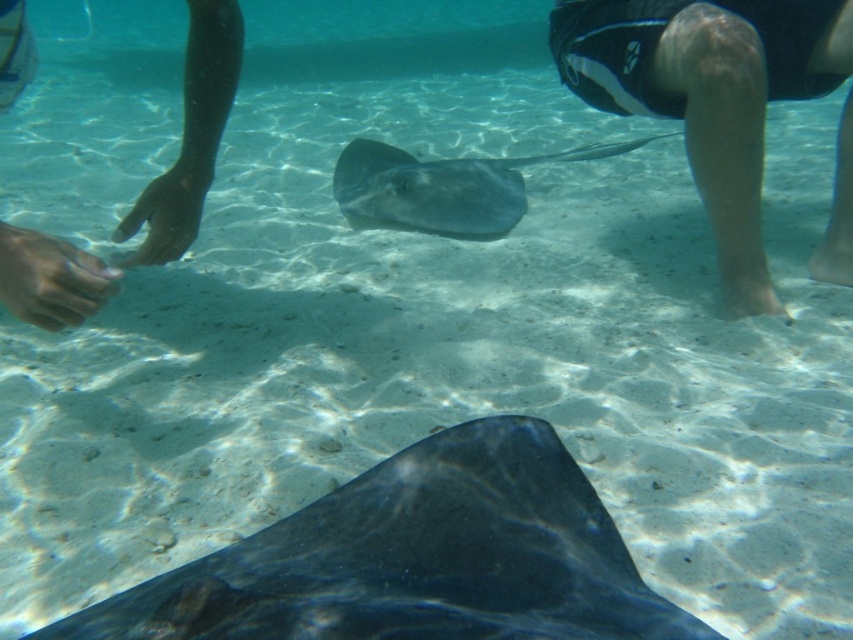
You are a marine biologist observing the underwater scene. You notice two stingrays. The shiny black stingray at bottom and the smooth gray stingray at center. Which one is bigger?

The smooth gray stingray at center is bigger than the shiny black stingray at bottom.

You are a marine biologist observing underwater. You notice the shiny black stingray at bottom and the smooth gray stingray at center. Which one is located lower in the water?

The shiny black stingray at bottom is positioned under the smooth gray stingray at center, so it is located lower in the water.